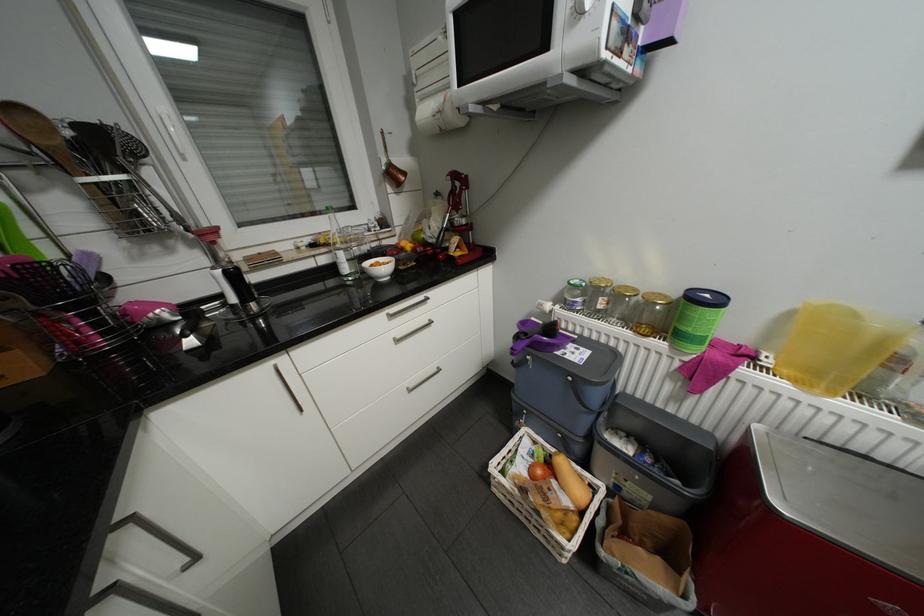
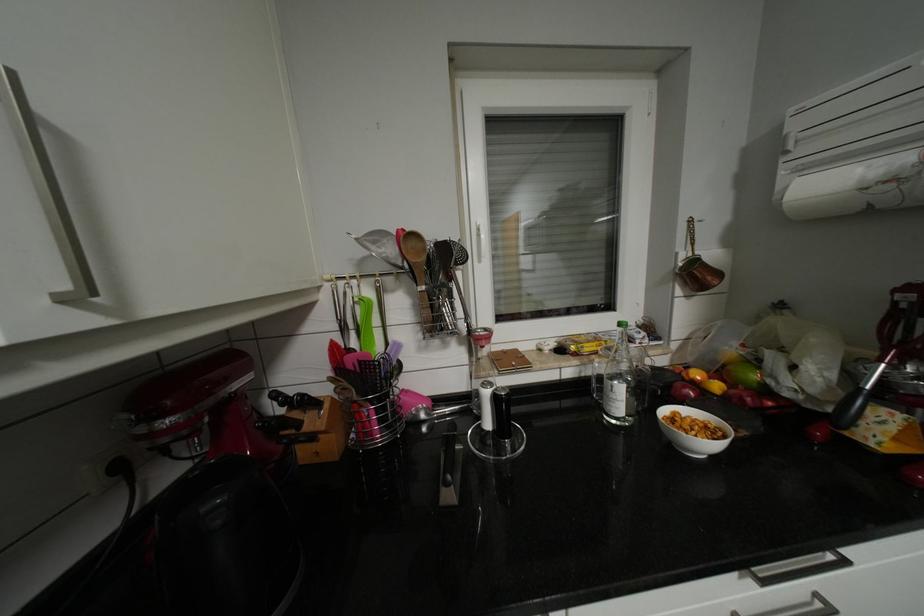
Locate, in the second image, the point that corresponds to (27,108) in the first image.

(421, 235)